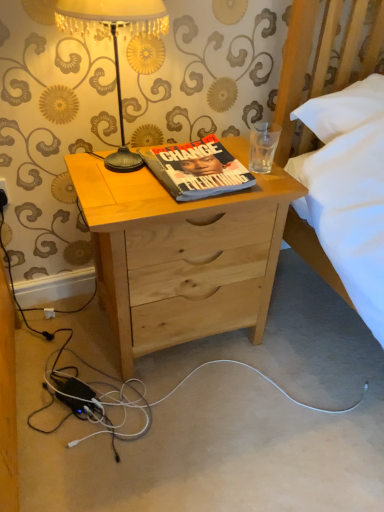
You are a GUI agent. You are given a task and a screenshot of the screen. Output one action in this format:
    pyautogui.click(x=<x>, y=<y>)
    Task: Click on the free spot in front of gold textured lampshade at upper left
    The height and width of the screenshot is (512, 384).
    Given the screenshot: What is the action you would take?
    click(130, 197)